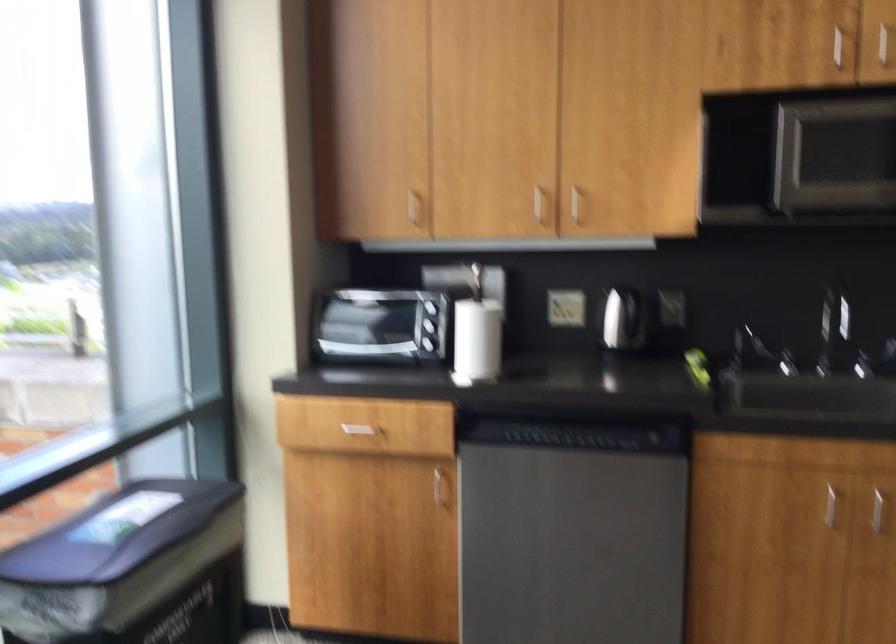
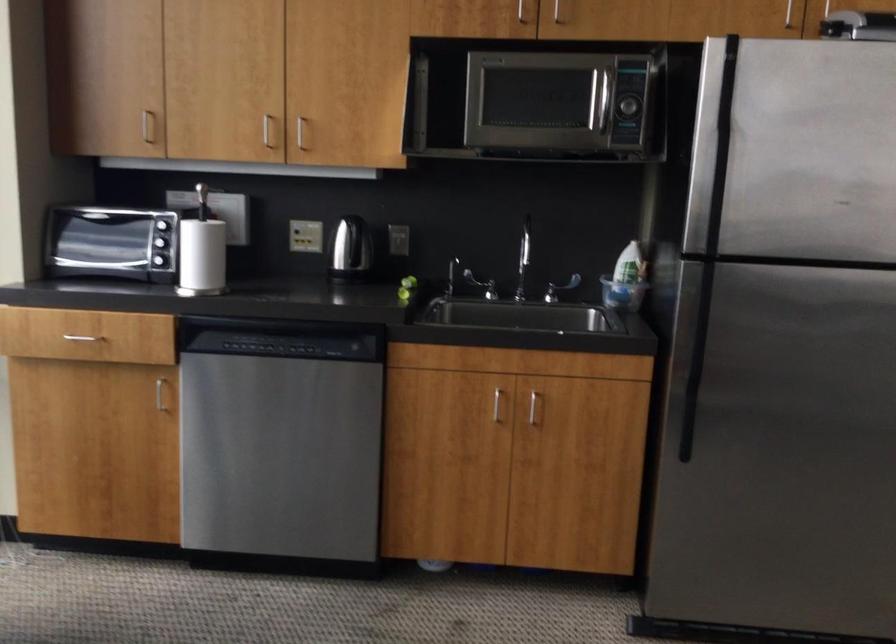
Find the pixel in the second image that matches [478,368] in the first image.

(202, 281)